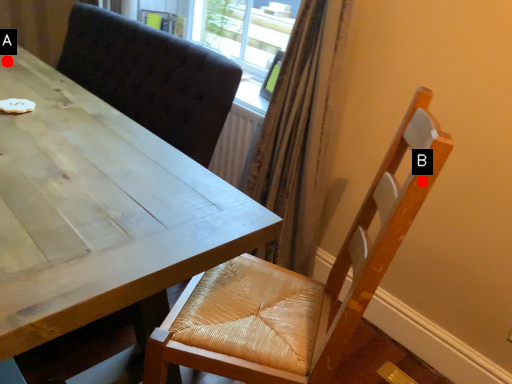
Question: Two points are circled on the image, labeled by A and B beside each circle. Which point is closer to the camera taking this photo?

Choices:
 (A) A is closer
 (B) B is closer

Answer: (B)